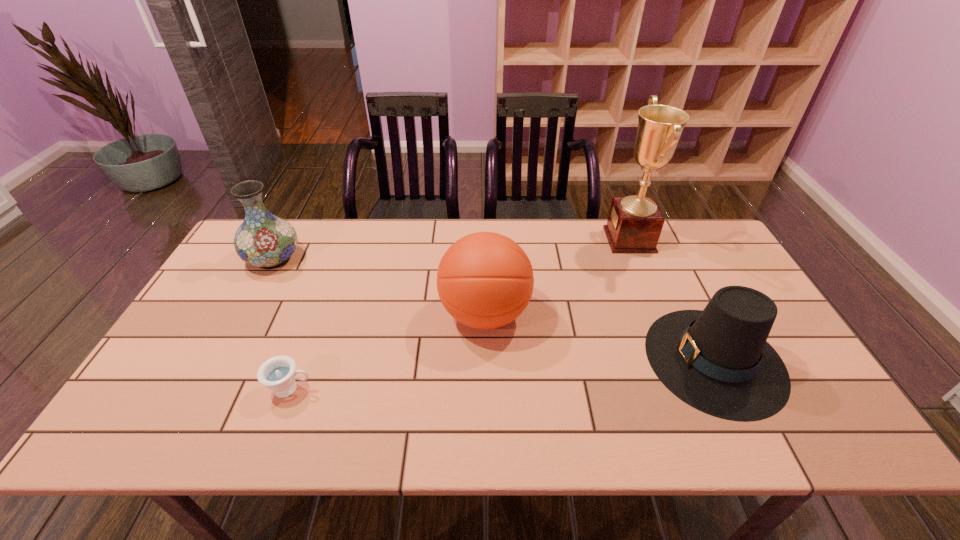
Where is `trophy cup`? trophy cup is located at coordinates (634, 225).

Where is `the leftmost object`? The image size is (960, 540). the leftmost object is located at coordinates (267, 241).

This screenshot has width=960, height=540. Identify the location of basketball. (485, 280).

What are the coordinates of `hat` in the screenshot? It's located at (718, 361).

This screenshot has width=960, height=540. In order to click on teacup in this screenshot , I will do `click(278, 374)`.

The image size is (960, 540). What are the coordinates of `the shortest object` in the screenshot? It's located at (278, 374).

The width and height of the screenshot is (960, 540). I want to click on vacant space situated on the plaque of the tallest object, so click(x=548, y=240).

Where is `vacant space located 0.060m on the plaque of the tallest object`? The image size is (960, 540). vacant space located 0.060m on the plaque of the tallest object is located at coordinates (589, 240).

Identify the location of free space located 0.080m on the plaque of the tallest object. (584, 240).

I want to click on blank area located on the front of the vase, so point(234,329).